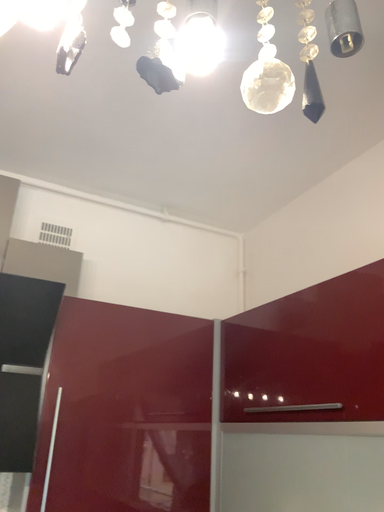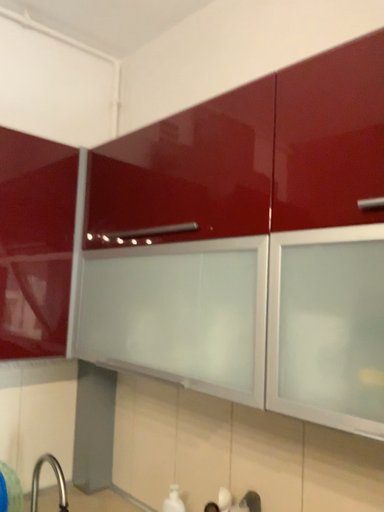
Question: Which way did the camera rotate in the video?

Choices:
 (A) rotated upward
 (B) rotated downward

Answer: (B)